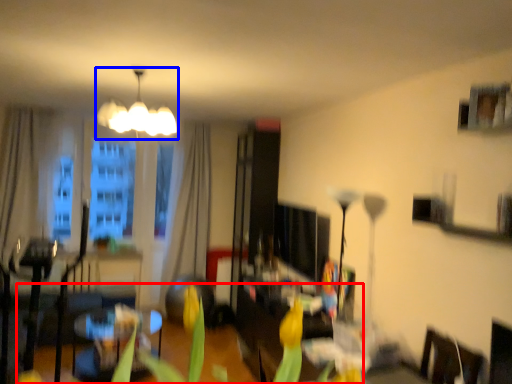
Question: Which of the following is the closest to the observer, plant (highlighted by a red box) or lamp (highlighted by a blue box)?

Choices:
 (A) plant
 (B) lamp

Answer: (A)